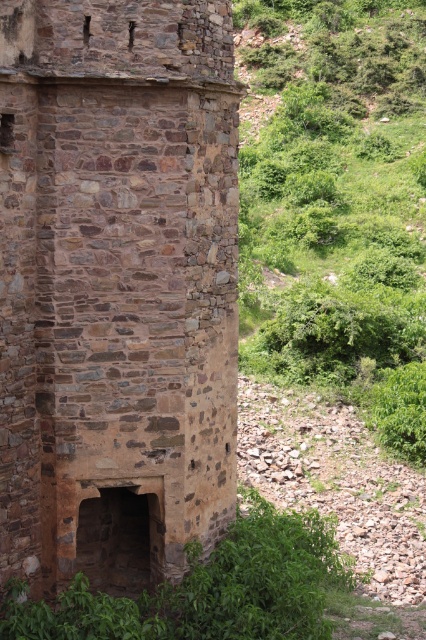
Which is more to the right, brown stone tower at left or green leafy vegetation at lower center?

green leafy vegetation at lower center is more to the right.

Does point (160, 54) come behind point (66, 636)?

Yes, point (160, 54) is behind point (66, 636).

You are a GUI agent. You are given a task and a screenshot of the screen. Output one action in this format:
    pyautogui.click(x=<x>, y=<y>)
    Task: Click on the brown stone tower at left
    
    Given the screenshot: What is the action you would take?
    pyautogui.click(x=115, y=285)

Is brown stone tower at left above green leafy shrubs at right?

No, brown stone tower at left is not above green leafy shrubs at right.

From the picture: Is brown stone tower at left to the left of green leafy shrubs at right from the viewer's perspective?

Yes, brown stone tower at left is to the left of green leafy shrubs at right.

Is point (150, 4) farther from viewer compared to point (394, 422)?

No.

Identify the location of brown stone tower at left. (115, 285).

Does point (386, 154) lie behind point (247, 536)?

Yes, point (386, 154) is behind point (247, 536).

Based on the photo, between green leafy shrubs at right and green leafy vegetation at lower center, which one has less height?

green leafy vegetation at lower center

Does point (342, 188) lie in front of point (267, 621)?

No, (342, 188) is behind (267, 621).

At what (x,y) coordinates should I click in order to perform the action: click on green leafy shrubs at right. Please return your answer as a coordinate pair (x, y). The height and width of the screenshot is (640, 426). Looking at the image, I should click on (339, 204).